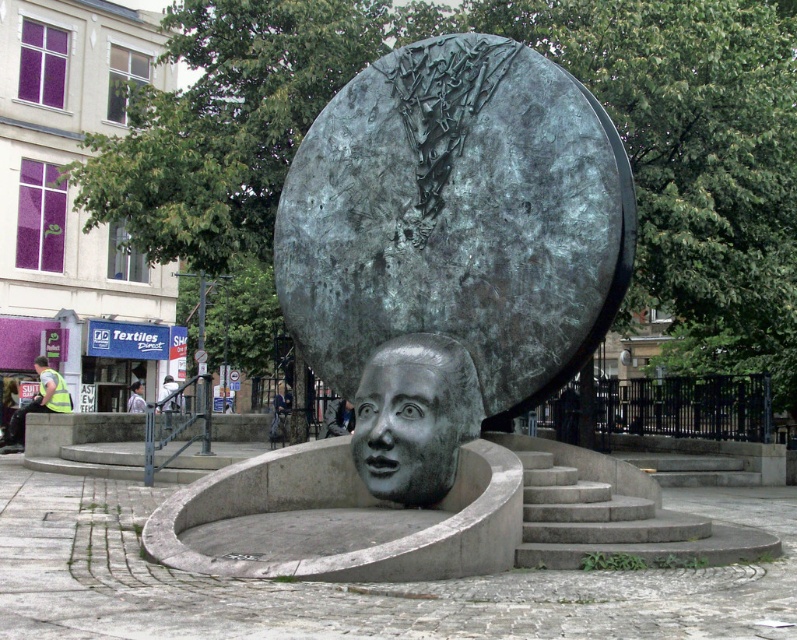
Question: Is reflective silver helmet at lower left smaller than bronze sculpture at center?

Choices:
 (A) no
 (B) yes

Answer: (A)

Question: Which of the following is the farthest from the observer?

Choices:
 (A) bronze sculpture at center
 (B) bronze face at center

Answer: (A)

Question: Is bronze textured sphere at center to the right of reflective silver helmet at lower left from the viewer's perspective?

Choices:
 (A) no
 (B) yes

Answer: (B)

Question: Which is nearer to the bronze textured sphere at center?

Choices:
 (A) reflective silver helmet at lower left
 (B) bronze sculpture at center
 (C) bronze face at center

Answer: (C)

Question: Considering the real-world distances, which object is farthest from the bronze sculpture at center?

Choices:
 (A) reflective silver helmet at lower left
 (B) bronze textured sphere at center
 (C) bronze face at center

Answer: (C)

Question: Does reflective silver helmet at lower left appear on the left side of bronze sculpture at center?

Choices:
 (A) no
 (B) yes

Answer: (A)